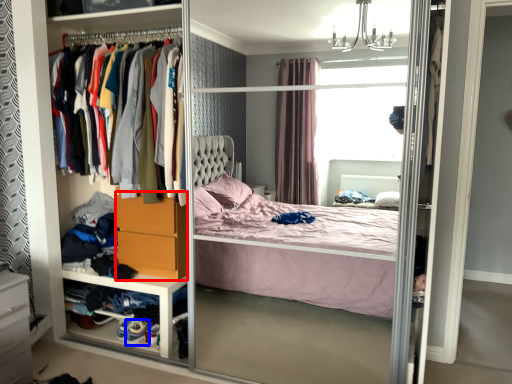
Question: Which object is closer to the camera taking this photo, dresser (highlighted by a red box) or shoe (highlighted by a blue box)?

Choices:
 (A) dresser
 (B) shoe

Answer: (A)